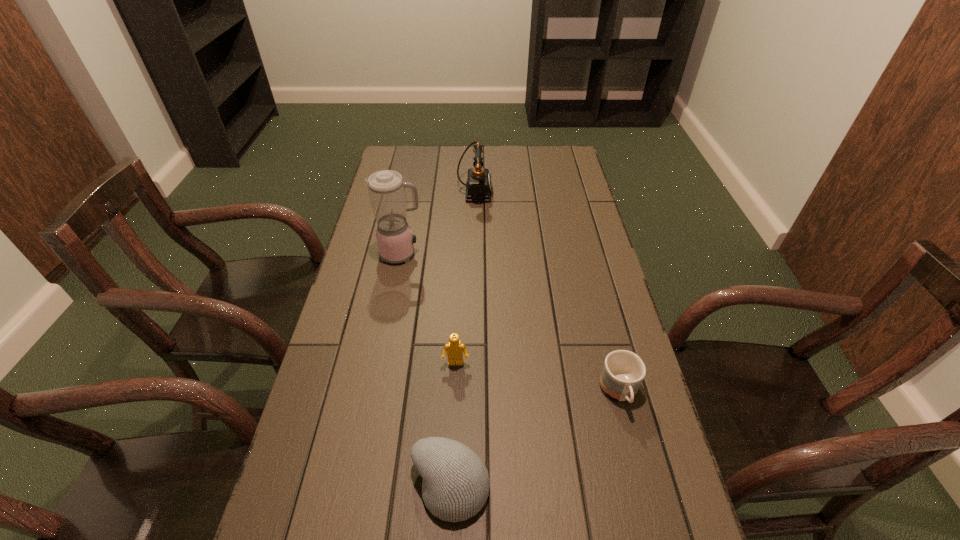
The image size is (960, 540). I want to click on empty location between the mug and the nearest object, so 535,440.

Locate an element on the screen. empty space between the second nearest object and the nearest object is located at coordinates (535, 440).

Identify the location of vacant area that lies between the shortest object and the fourth shortest object. (547, 292).

At what (x,y) coordinates should I click in order to perform the action: click on empty space between the beanie and the telephone. Please return your answer as a coordinate pair (x, y). The height and width of the screenshot is (540, 960). Looking at the image, I should click on (463, 339).

This screenshot has height=540, width=960. In order to click on free spot between the shortest object and the fourth shortest object in this screenshot , I will do `click(547, 292)`.

This screenshot has height=540, width=960. I want to click on blank region between the shortest object and the third nearest object, so click(x=538, y=378).

Identify the location of free point between the rightmost object and the Lego. coord(538,378).

Identify the location of blank region between the leftmost object and the rightmost object. [511, 323].

Identify the location of object identified as the third closest to the fourth farthest object. Image resolution: width=960 pixels, height=540 pixels. (386, 188).

I want to click on the fourth closest object to the third nearest object, so click(x=479, y=187).